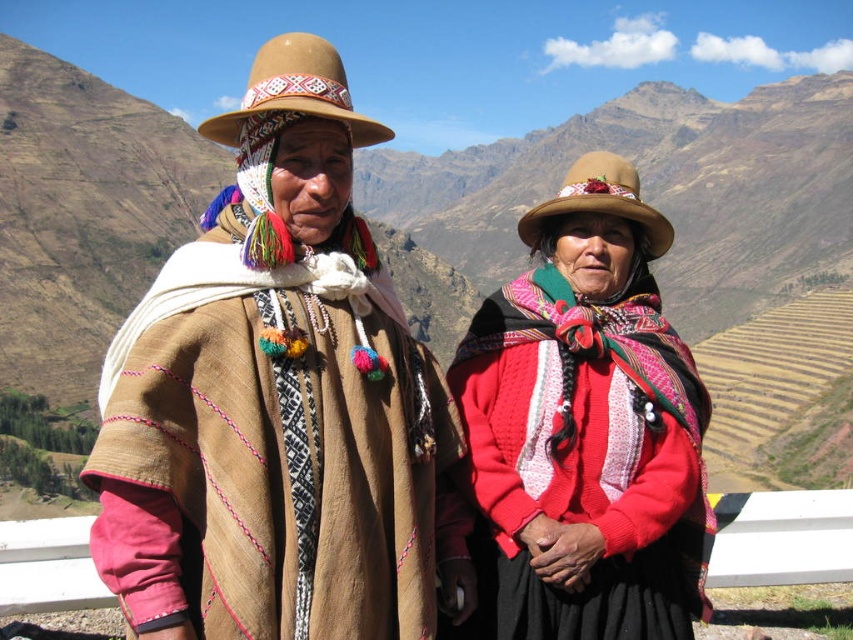
You are a photographer trying to capture the brown woven hat at center and the brown woolen poncho at left in a single shot. Which object will appear closer to the camera in the photo?

The brown woven hat at center appears closer to the camera because it is positioned over the brown woolen poncho at left, indicating it is in front spatially.

You are an anthropologist documenting traditional Peruvian clothing. You notice the brown woolen poncho at left and the knitted wool shawl at center. Which garment is larger in size?

The knitted wool shawl at center is larger than the brown woolen poncho at left.

You are a photographer planning to take a portrait of the two people in the scene. You want to ensure that both the brown woven hat at center and the knitted wool shawl at center are clearly visible in the photo. Given their sizes, which object should you focus on first to ensure proper framing?

The brown woven hat at center is larger in size compared to the knitted wool shawl at center, so focusing on it first will help ensure proper framing for both objects.